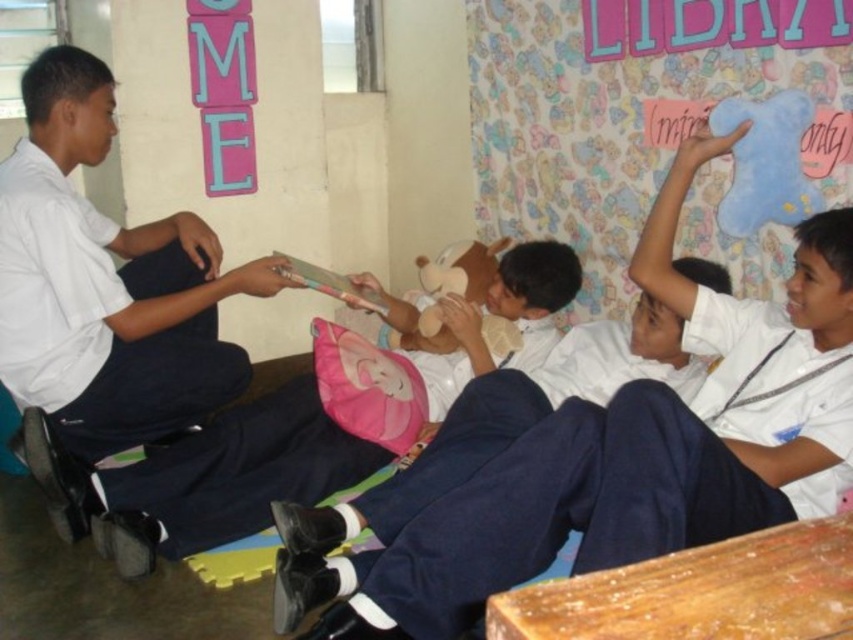
Question: Which object appears closest to the camera in this image?

Choices:
 (A) white uniform shirt at center
 (B) white matte uniform at left

Answer: (A)

Question: Based on their relative distances, which object is farther from the white matte uniform at left?

Choices:
 (A) white uniform shirt at center
 (B) white matte uniform at center

Answer: (B)

Question: Is white matte uniform at center in front of white uniform shirt at center?

Choices:
 (A) yes
 (B) no

Answer: (A)

Question: Which of the following is the closest to the observer?

Choices:
 (A) white matte uniform at left
 (B) white matte uniform at center

Answer: (B)

Question: Is white matte uniform at center positioned at the back of white uniform shirt at center?

Choices:
 (A) no
 (B) yes

Answer: (A)

Question: Can you confirm if white matte uniform at left is positioned below white uniform shirt at center?

Choices:
 (A) yes
 (B) no

Answer: (B)